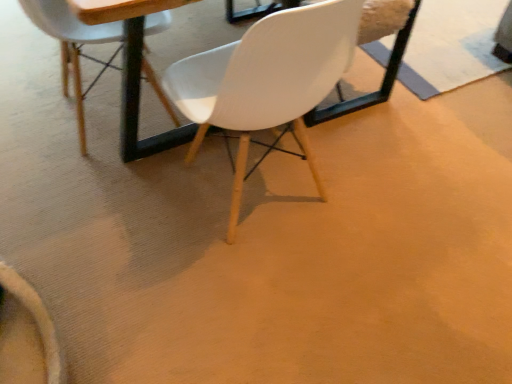
Question: Which direction should I rotate to look at white matte chair at center, acting as the 1th chair starting from the right?

Choices:
 (A) right
 (B) left

Answer: (A)

Question: Is matte white chair at upper center, which ranks as the second chair in right-to-left order, not close to wooden round table at center?

Choices:
 (A) yes
 (B) no

Answer: (B)

Question: Does matte white chair at upper center, which appears as the first chair when viewed from the left, have a larger size compared to wooden round table at center?

Choices:
 (A) no
 (B) yes

Answer: (A)

Question: Does matte white chair at upper center, which ranks as the second chair in right-to-left order, have a lesser width compared to wooden round table at center?

Choices:
 (A) yes
 (B) no

Answer: (A)

Question: Is matte white chair at upper center, which appears as the first chair when viewed from the left, at the right side of wooden round table at center?

Choices:
 (A) yes
 (B) no

Answer: (B)

Question: Can you confirm if matte white chair at upper center, which ranks as the second chair in right-to-left order, is wider than wooden round table at center?

Choices:
 (A) yes
 (B) no

Answer: (B)

Question: From a real-world perspective, is matte white chair at upper center, which appears as the first chair when viewed from the left, below wooden round table at center?

Choices:
 (A) no
 (B) yes

Answer: (B)

Question: Can you confirm if wooden round table at center is bigger than matte white chair at upper center, which ranks as the second chair in right-to-left order?

Choices:
 (A) yes
 (B) no

Answer: (A)

Question: Is the depth of wooden round table at center greater than that of matte white chair at upper center, which ranks as the second chair in right-to-left order?

Choices:
 (A) no
 (B) yes

Answer: (A)

Question: Considering the relative positions of wooden round table at center and matte white chair at upper center, which appears as the first chair when viewed from the left, in the image provided, is wooden round table at center to the left of matte white chair at upper center, which appears as the first chair when viewed from the left, from the viewer's perspective?

Choices:
 (A) no
 (B) yes

Answer: (A)

Question: Can you confirm if wooden round table at center is thinner than matte white chair at upper center, which appears as the first chair when viewed from the left?

Choices:
 (A) no
 (B) yes

Answer: (A)

Question: From the image's perspective, is wooden round table at center on matte white chair at upper center, which ranks as the second chair in right-to-left order?

Choices:
 (A) no
 (B) yes

Answer: (B)

Question: From a real-world perspective, is wooden round table at center on matte white chair at upper center, which appears as the first chair when viewed from the left?

Choices:
 (A) yes
 (B) no

Answer: (A)

Question: Can you confirm if wooden round table at center is thinner than white matte chair at center, acting as the 1th chair starting from the right?

Choices:
 (A) no
 (B) yes

Answer: (A)